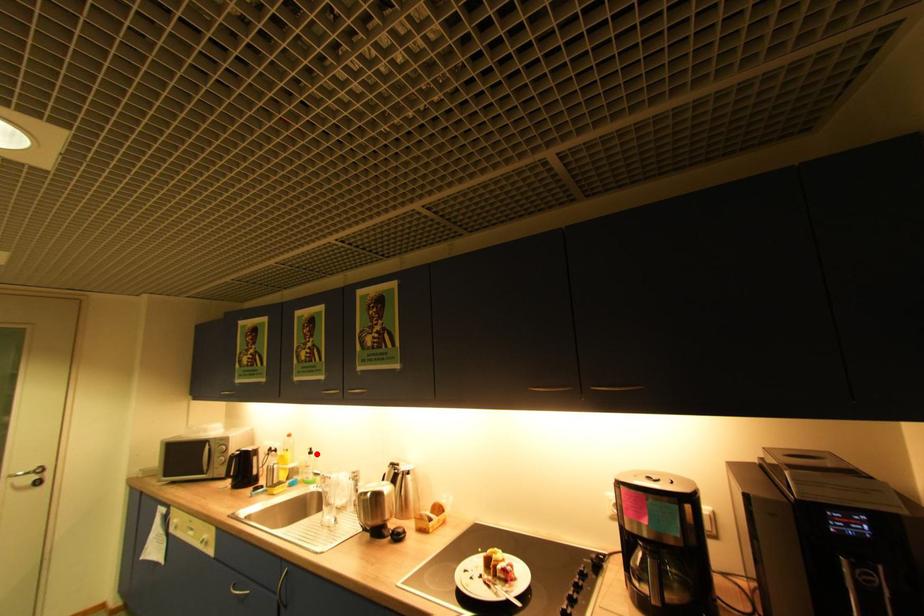
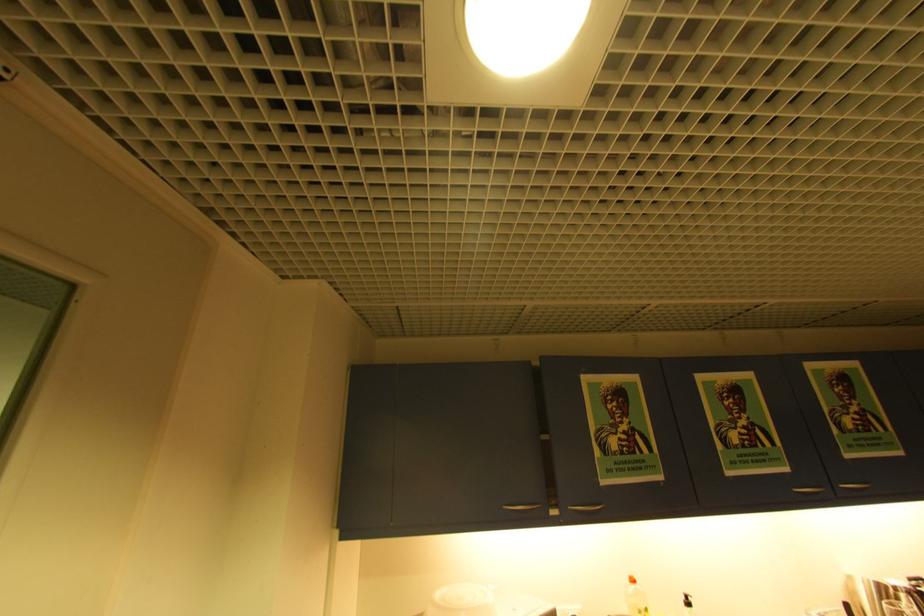
Question: A red point is marked in image1. In image2, is the corresponding 3D point closer to the camera or farther? Reply with the corresponding letter.

Choices:
 (A) The corresponding 3D point is closer.
 (B) The corresponding 3D point is farther.

Answer: (A)